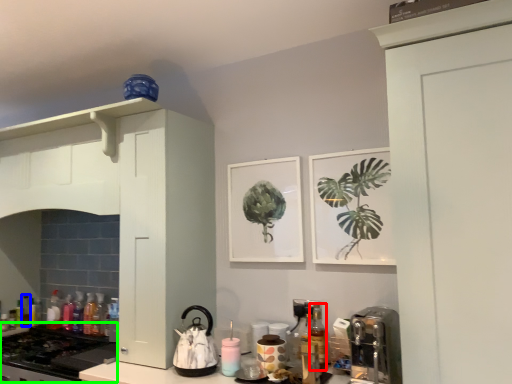
Question: Which is farther away from bottle (highlighted by a red box)? bottle (highlighted by a blue box) or gas stove (highlighted by a green box)?

Choices:
 (A) bottle
 (B) gas stove

Answer: (A)